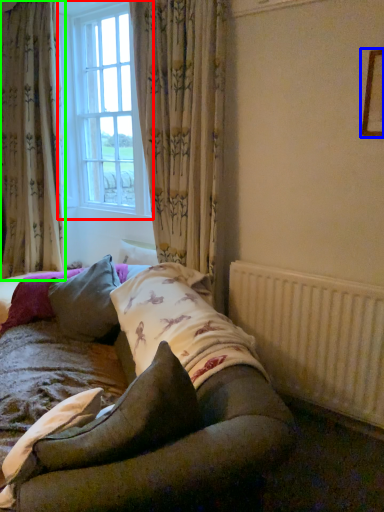
Question: Considering the real-world distances, which object is farthest from window (highlighted by a red box)? picture frame (highlighted by a blue box) or curtain (highlighted by a green box)?

Choices:
 (A) picture frame
 (B) curtain

Answer: (A)